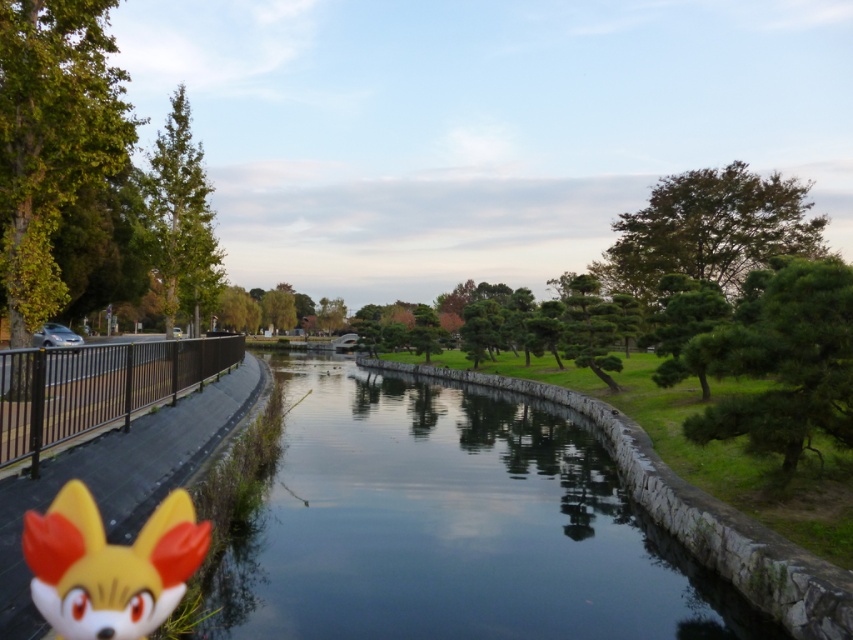
Question: Which of the following is the closest to the observer?

Choices:
 (A) tap(193, 509)
 (B) tap(379, 412)

Answer: (A)

Question: Is smooth stone river at center smaller than yellow matte fox head at lower left?

Choices:
 (A) yes
 (B) no

Answer: (B)

Question: Can you confirm if smooth stone river at center is thinner than yellow matte fox head at lower left?

Choices:
 (A) yes
 (B) no

Answer: (B)

Question: Which point appears farthest from the camera in this image?

Choices:
 (A) click(434, 516)
 (B) click(177, 513)

Answer: (A)

Question: Does smooth stone river at center have a greater width compared to yellow matte fox head at lower left?

Choices:
 (A) yes
 (B) no

Answer: (A)